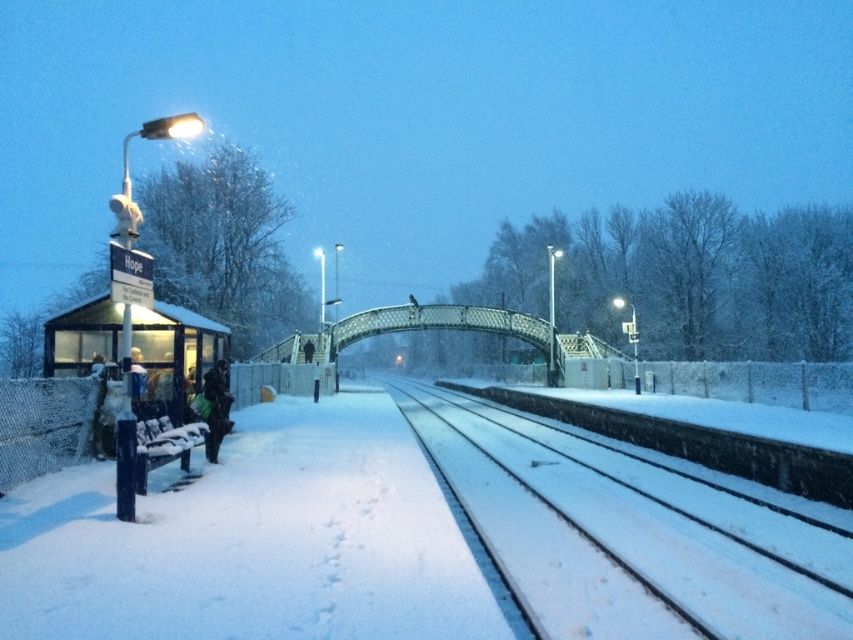
Question: Does snow-covered tracks at center have a smaller size compared to dark green jacket at left?

Choices:
 (A) yes
 (B) no

Answer: (B)

Question: Among these objects, which one is nearest to the camera?

Choices:
 (A) snow-covered tracks at center
 (B) dark green jacket at left

Answer: (A)

Question: Which of the following is the closest to the observer?

Choices:
 (A) (227, 413)
 (B) (593, 460)

Answer: (A)

Question: Does snow-covered tracks at center appear on the left side of dark green jacket at left?

Choices:
 (A) no
 (B) yes

Answer: (A)

Question: Considering the relative positions of snow-covered tracks at center and dark green jacket at left in the image provided, where is snow-covered tracks at center located with respect to dark green jacket at left?

Choices:
 (A) left
 (B) right

Answer: (B)